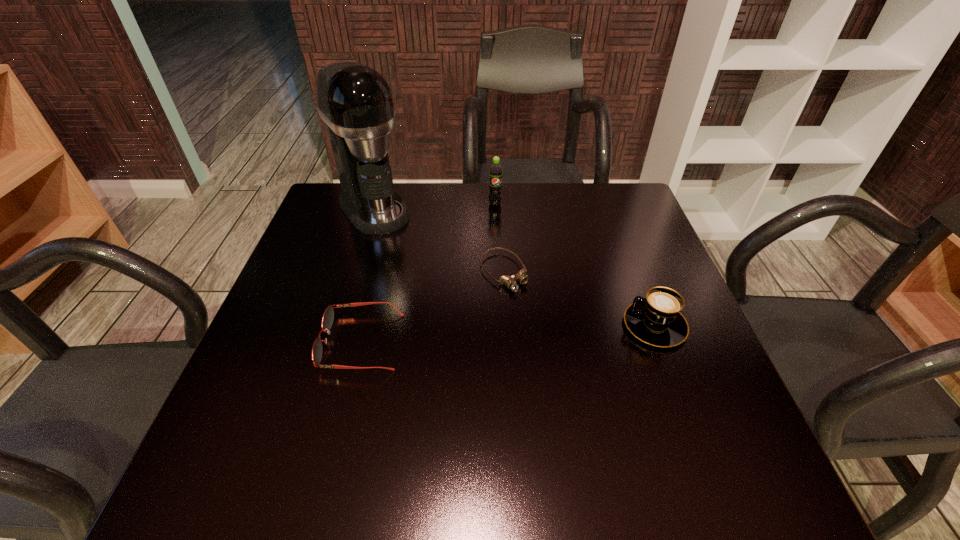
Where is `vacant spot on the desktop that is between the spectacles and the rightmost object and is positioned place cup under the spout of the coffee maker`? The height and width of the screenshot is (540, 960). vacant spot on the desktop that is between the spectacles and the rightmost object and is positioned place cup under the spout of the coffee maker is located at coordinates (482, 335).

Image resolution: width=960 pixels, height=540 pixels. Find the location of `free space on the desktop that is between the spectacles and the rightmost object and is positioned on the front lenses and sides of the third nearest object`. free space on the desktop that is between the spectacles and the rightmost object and is positioned on the front lenses and sides of the third nearest object is located at coordinates (554, 331).

Where is `free spot on the desktop that is between the spectacles and the third shortest object and is positioned on the front label of the soda`? free spot on the desktop that is between the spectacles and the third shortest object and is positioned on the front label of the soda is located at coordinates (501, 334).